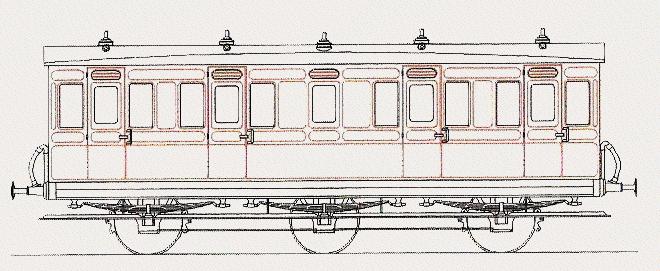
The height and width of the screenshot is (271, 660). Find the location of `window door`. window door is located at coordinates (420, 100).